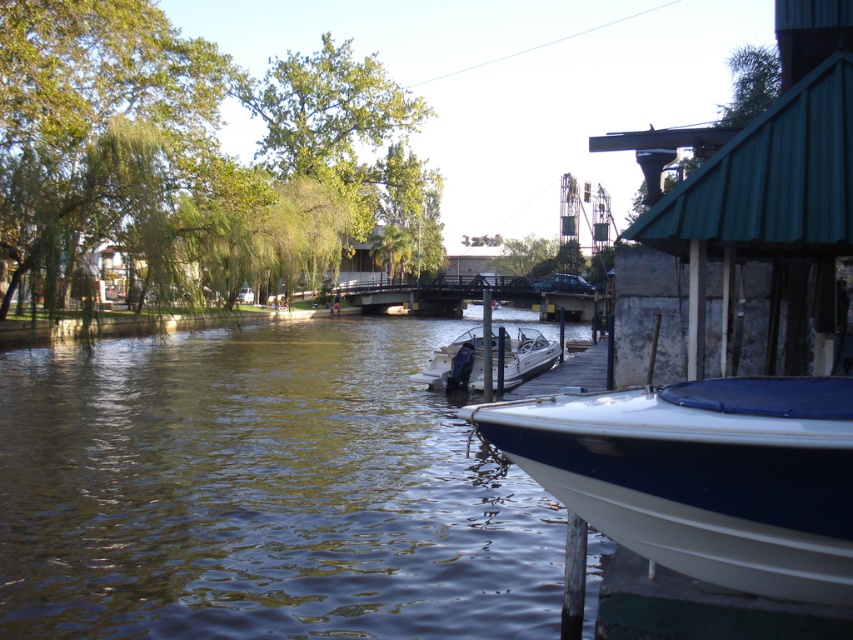
Question: Is green leafy tree at upper left bigger than green leafy tree at upper center?

Choices:
 (A) no
 (B) yes

Answer: (A)

Question: Is the position of greenish water at lower left more distant than that of green leafy tree at upper center?

Choices:
 (A) yes
 (B) no

Answer: (B)

Question: Is greenish water at lower left further to camera compared to white glossy motorboat at center?

Choices:
 (A) yes
 (B) no

Answer: (B)

Question: Which object is the closest to the green leafy tree at upper center?

Choices:
 (A) green leafy tree at center
 (B) green leafy tree at upper left
 (C) greenish water at lower left

Answer: (B)

Question: Based on their relative distances, which object is farther from the green leafy tree at center?

Choices:
 (A) green leafy tree at upper center
 (B) green leafy tree at upper left
 (C) white glossy motorboat at center

Answer: (C)

Question: Estimate the real-world distances between objects in this image. Which object is closer to the green leafy tree at upper left?

Choices:
 (A) white glossy motorboat at center
 (B) white glossy boat at lower right
 (C) greenish water at lower left
 (D) green leafy tree at center

Answer: (C)